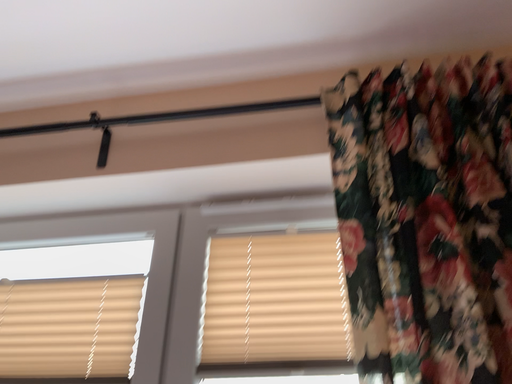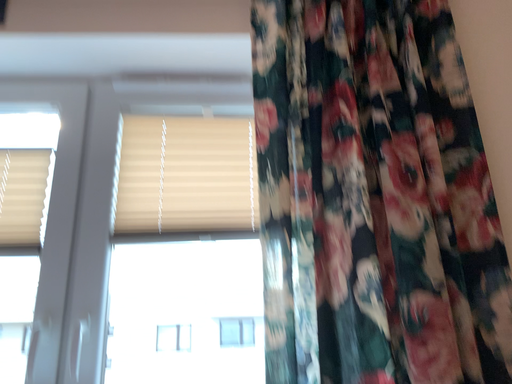
Question: Which way did the camera rotate in the video?

Choices:
 (A) rotated upward
 (B) rotated downward

Answer: (B)